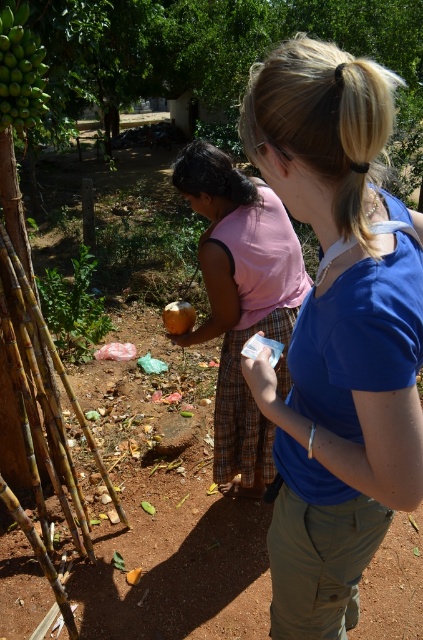
Between blue cotton shirt at upper right and green matte bananas at upper left, which one is positioned higher?

green matte bananas at upper left is higher up.

Does blue cotton shirt at upper right have a larger size compared to green matte bananas at upper left?

Correct, blue cotton shirt at upper right is larger in size than green matte bananas at upper left.

Is point (365, 340) closer to camera compared to point (38, 100)?

Yes, it is.

Identify the location of blue cotton shirt at upper right. The width and height of the screenshot is (423, 640). (337, 332).

Is green matte bananas at upper left below smooth brown coconut at center?

No, green matte bananas at upper left is not below smooth brown coconut at center.

Between green matte bananas at upper left and smooth brown coconut at center, which one has more height?

green matte bananas at upper left

Is point (2, 19) positioned before point (162, 317)?

Yes, point (2, 19) is in front of point (162, 317).

The width and height of the screenshot is (423, 640). Identify the location of green matte bananas at upper left. (21, 70).

Which is below, blue cotton shirt at upper right or smooth brown coconut at center?

blue cotton shirt at upper right

Describe the element at coordinates (337, 332) in the screenshot. I see `blue cotton shirt at upper right` at that location.

I want to click on blue cotton shirt at upper right, so click(x=337, y=332).